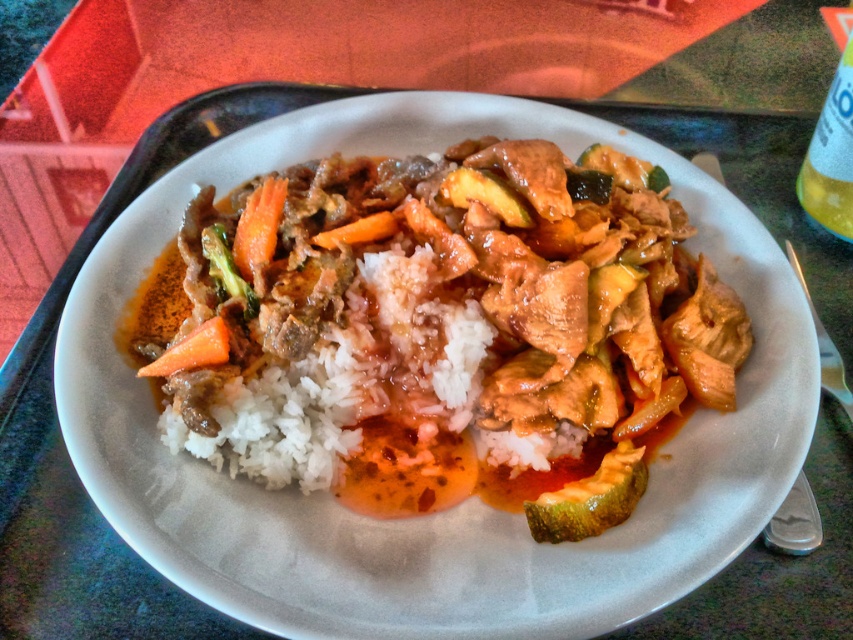
Who is taller, white rice at center or orange matte carrot at center?

white rice at center is taller.

Which is behind, point (524, 268) or point (219, 320)?

The point (524, 268) is behind.

This screenshot has width=853, height=640. Find the location of `white rice at center`. white rice at center is located at coordinates (451, 333).

This screenshot has width=853, height=640. What are the coordinates of `translucent plastic bottle at upper right` in the screenshot? It's located at (831, 156).

Who is positioned more to the right, translucent plastic bottle at upper right or orange matte carrot at center?

Positioned to the right is translucent plastic bottle at upper right.

The width and height of the screenshot is (853, 640). I want to click on translucent plastic bottle at upper right, so tap(831, 156).

Between white rice at center and orange smooth carrot at center, which one appears on the left side from the viewer's perspective?

orange smooth carrot at center

Is point (422, 364) in front of point (238, 218)?

Yes.

I want to click on white rice at center, so click(451, 333).